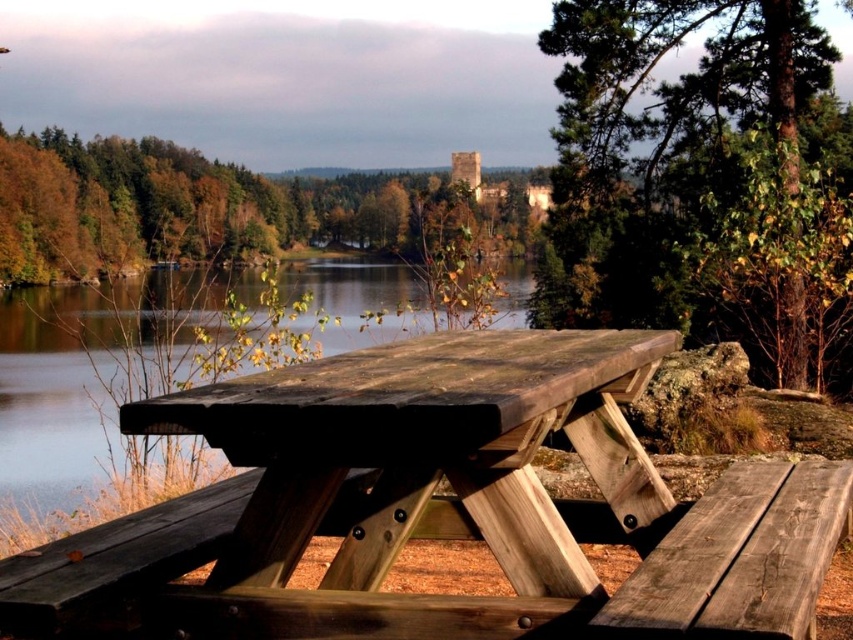
Question: Which point is closer to the camera taking this photo?

Choices:
 (A) tap(297, 182)
 (B) tap(77, 388)
 (C) tap(780, 468)
 (D) tap(402, 468)

Answer: (D)

Question: Is weathered wood picnic table at center further to the viewer compared to green leafy tree at upper center?

Choices:
 (A) no
 (B) yes

Answer: (A)

Question: Is green leafy tree at upper center thinner than weathered wood bench at lower right?

Choices:
 (A) yes
 (B) no

Answer: (B)

Question: Which object appears closest to the camera in this image?

Choices:
 (A) brown wooden lake at center
 (B) weathered wood picnic table at center
 (C) green rough bark tree at upper right

Answer: (B)

Question: Which object appears closest to the camera in this image?

Choices:
 (A) brown wooden lake at center
 (B) green rough bark tree at upper right

Answer: (A)

Question: Can you confirm if green leafy tree at upper center is positioned to the right of weathered wood bench at lower right?

Choices:
 (A) no
 (B) yes

Answer: (A)